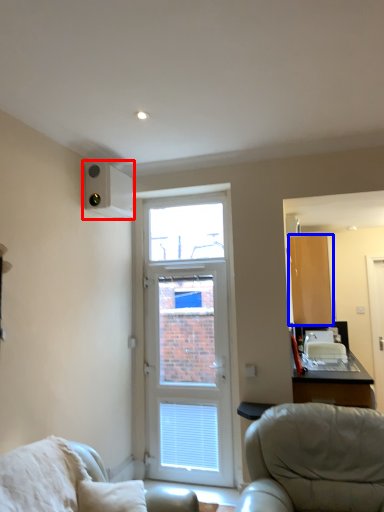
Question: Which object appears closest to the camera in this image, air conditioning (highlighted by a red box) or cabinetry (highlighted by a blue box)?

Choices:
 (A) air conditioning
 (B) cabinetry

Answer: (A)